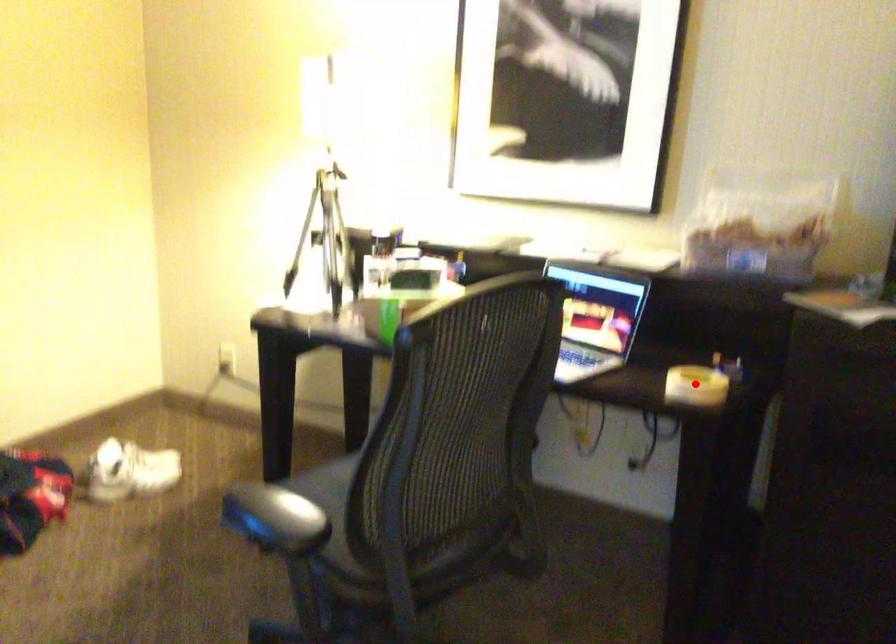
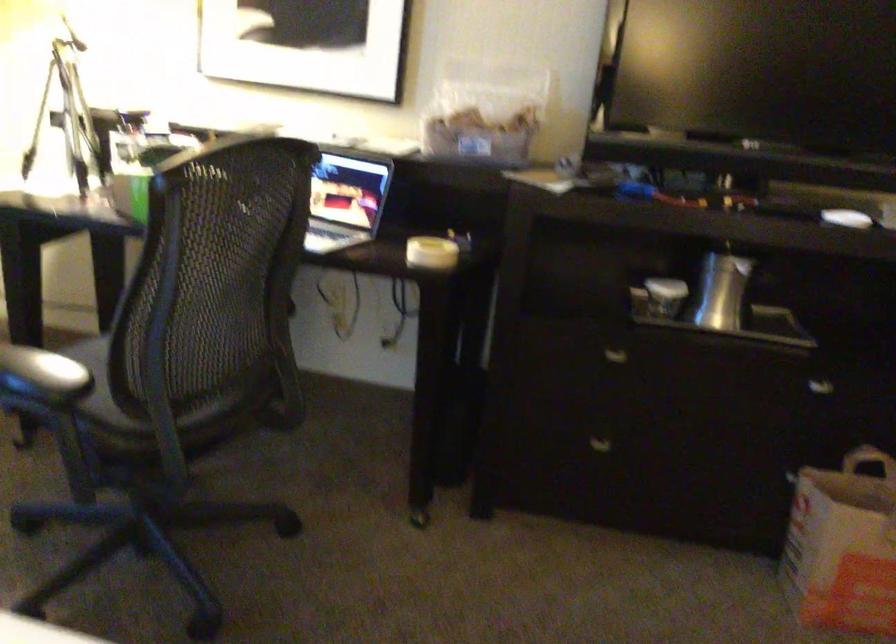
Find the pixel in the second image that matches the highlighted location in the first image.

(431, 252)